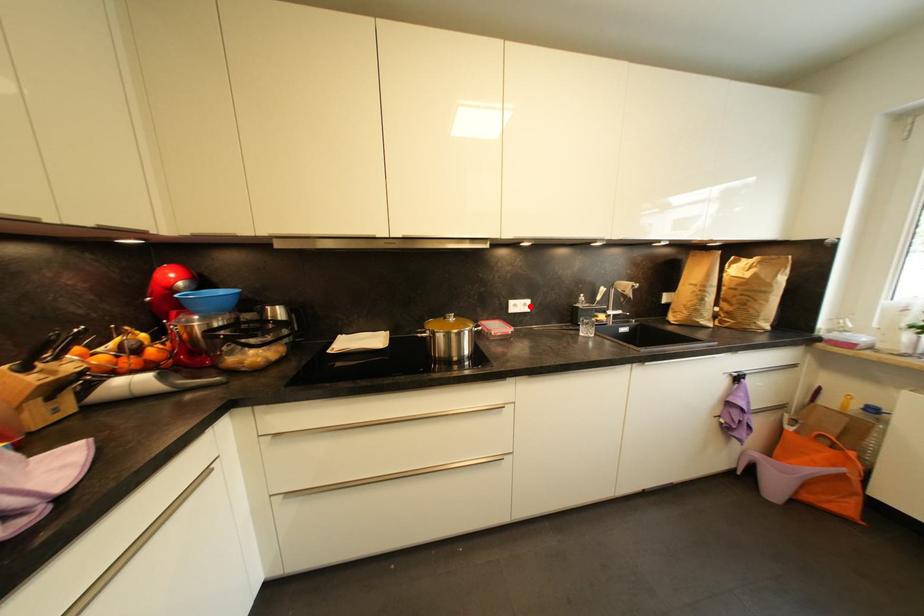
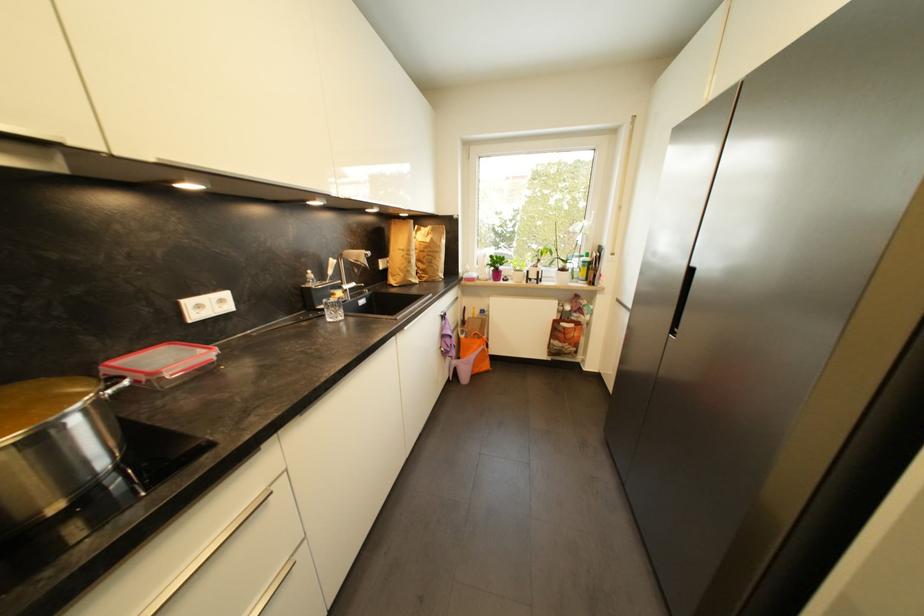
The point at the highlighted location is marked in the first image. Where is the corresponding point in the second image?

(226, 302)